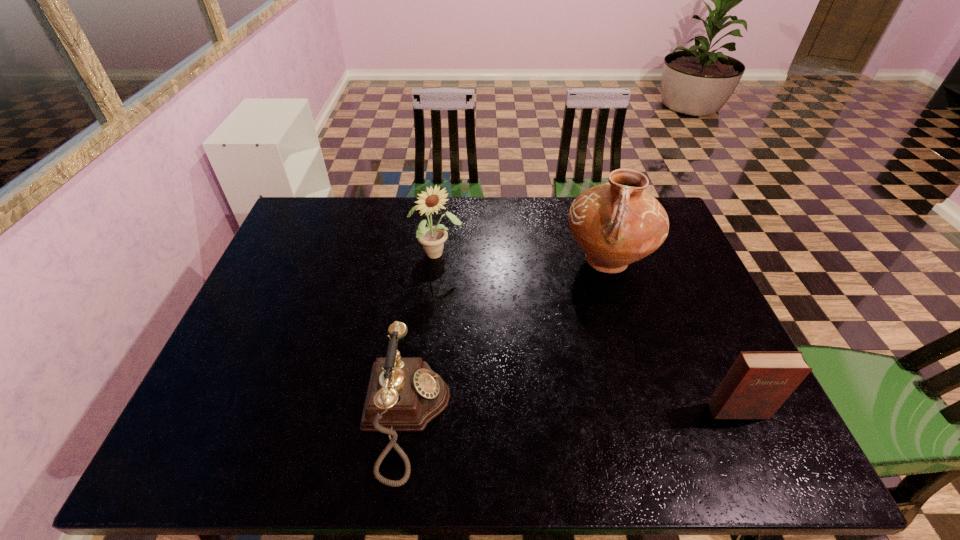
Where is `free space between the diary and the sunflower`? free space between the diary and the sunflower is located at coordinates (587, 333).

The width and height of the screenshot is (960, 540). I want to click on unoccupied area between the pottery and the telephone, so click(506, 339).

Locate an element on the screen. The image size is (960, 540). free space between the pottery and the telephone is located at coordinates (506, 339).

Where is `empty location between the sunflower and the telephone`? empty location between the sunflower and the telephone is located at coordinates (421, 335).

At what (x,y) coordinates should I click in order to perform the action: click on object that is the third closest to the sunflower. Please return your answer as a coordinate pair (x, y). The height and width of the screenshot is (540, 960). Looking at the image, I should click on (759, 382).

You are a GUI agent. You are given a task and a screenshot of the screen. Output one action in this format:
    pyautogui.click(x=<x>, y=<y>)
    Task: Click on the object that stands as the third closest to the diary
    This screenshot has width=960, height=540.
    Given the screenshot: What is the action you would take?
    pyautogui.click(x=432, y=238)